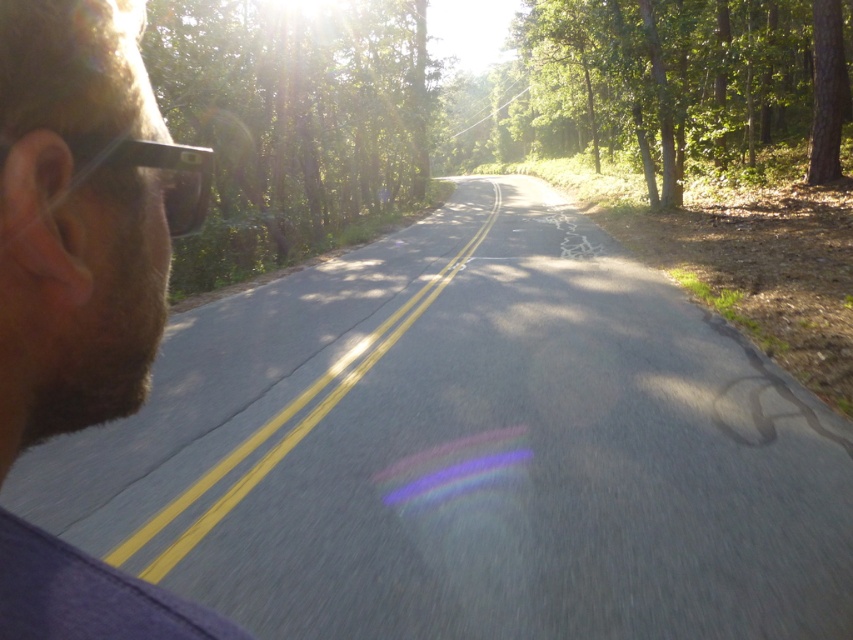
You are a photographer standing in the forest and see the green leafy tree at upper center and the transparent plastic glasses at left. Which object is positioned more to the left?

The green leafy tree at upper center is positioned to the left of the transparent plastic glasses at left, so the green leafy tree at upper center is more to the left.

You are driving a car and see two points on the road ahead. The first point is at coordinates point [74,593] and the second point is at point [584,109]. Which point is closer to your current position?

Point [74,593] is in front of point [584,109], so the first point is closer to your current position.

You are a photographer holding transparent plastic glasses at left. You want to take a photo of the green leafy tree at upper right. Will the glasses block your view of the tree?

The green leafy tree at upper right is positioned over transparent plastic glasses at left, so the glasses will not block your view of the tree because the tree is above the glasses.